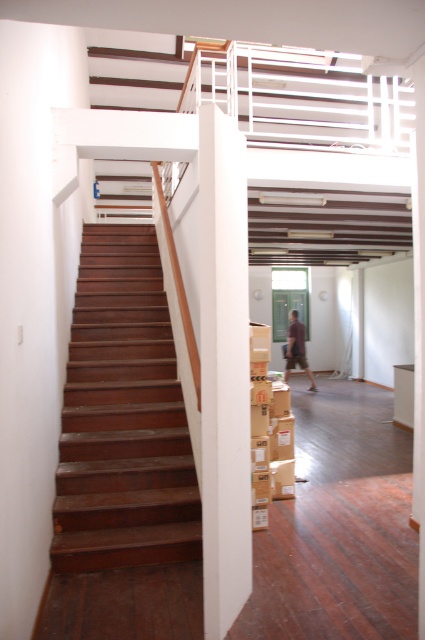
Question: Where is dark wood stairs at left located in relation to white smooth pillar at center in the image?

Choices:
 (A) above
 (B) below

Answer: (B)

Question: Among these objects, which one is farthest from the camera?

Choices:
 (A) dark wood stairs at left
 (B) white smooth pillar at center
 (C) brown fabric pants at center

Answer: (C)

Question: Which of the following is the farthest from the observer?

Choices:
 (A) (119, 401)
 (B) (297, 348)
 (C) (227, 449)

Answer: (B)

Question: Can you confirm if dark wood stairs at left is positioned above brown fabric pants at center?

Choices:
 (A) yes
 (B) no

Answer: (B)

Question: Does dark wood stairs at left have a larger size compared to brown fabric pants at center?

Choices:
 (A) no
 (B) yes

Answer: (B)

Question: Considering the real-world distances, which object is closest to the white smooth pillar at center?

Choices:
 (A) dark wood stairs at left
 (B) brown fabric pants at center

Answer: (A)